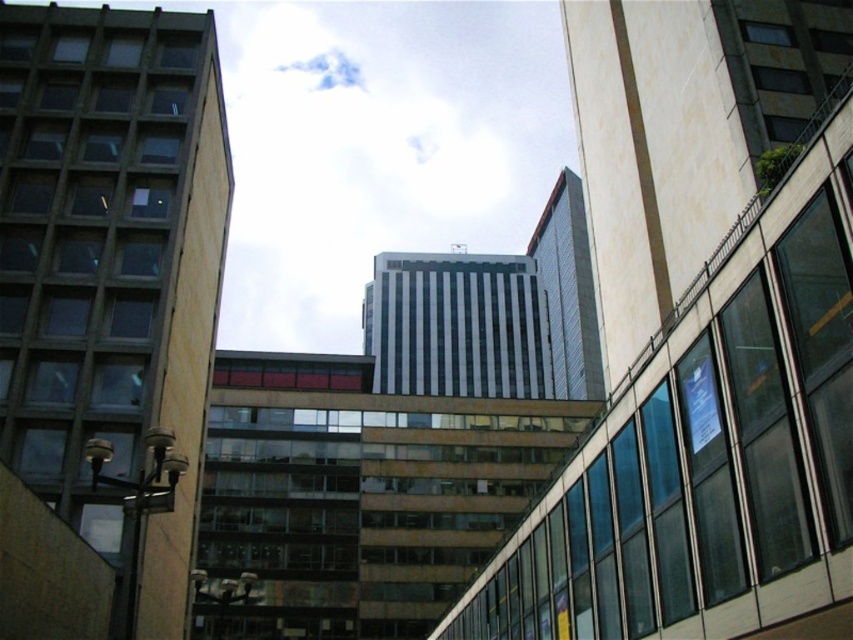
Question: Can you confirm if glassy reflective building at center is positioned below matte concrete building at left?

Choices:
 (A) no
 (B) yes

Answer: (B)

Question: Can you confirm if glassy reflective building at center is positioned above matte concrete building at left?

Choices:
 (A) no
 (B) yes

Answer: (A)

Question: Is glassy reflective building at center to the right of matte concrete building at left from the viewer's perspective?

Choices:
 (A) no
 (B) yes

Answer: (B)

Question: Which of the following is the farthest from the observer?

Choices:
 (A) glassy reflective building at center
 (B) matte concrete building at left

Answer: (B)